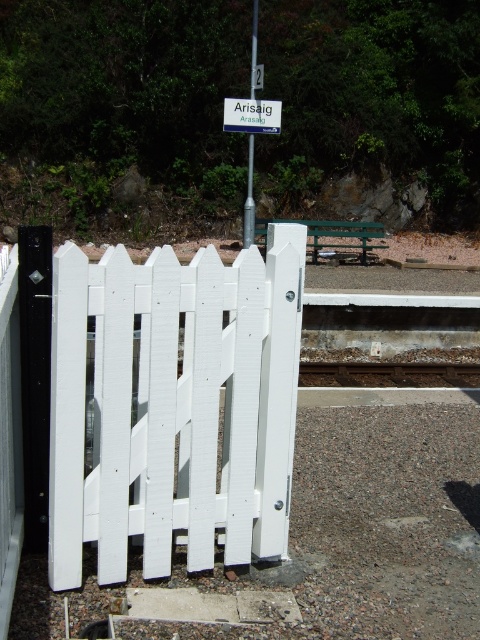
Question: Which point is closer to the camera?

Choices:
 (A) (288, 280)
 (B) (372, 385)

Answer: (A)

Question: Estimate the real-world distances between objects in this image. Which object is farther from the brown gravel train track at center?

Choices:
 (A) metallic pole at center
 (B) white painted wood gate at center

Answer: (B)

Question: Can you confirm if white painted wood gate at center is positioned above brown gravel train track at center?

Choices:
 (A) no
 (B) yes

Answer: (B)

Question: Where is brown gravel train track at center located in relation to metallic pole at center in the image?

Choices:
 (A) above
 (B) below

Answer: (B)

Question: Considering the real-world distances, which object is closest to the metallic pole at center?

Choices:
 (A) brown gravel train track at center
 (B) white painted wood gate at center

Answer: (A)

Question: From the image, what is the correct spatial relationship of white painted wood gate at center in relation to brown gravel train track at center?

Choices:
 (A) above
 (B) below

Answer: (A)